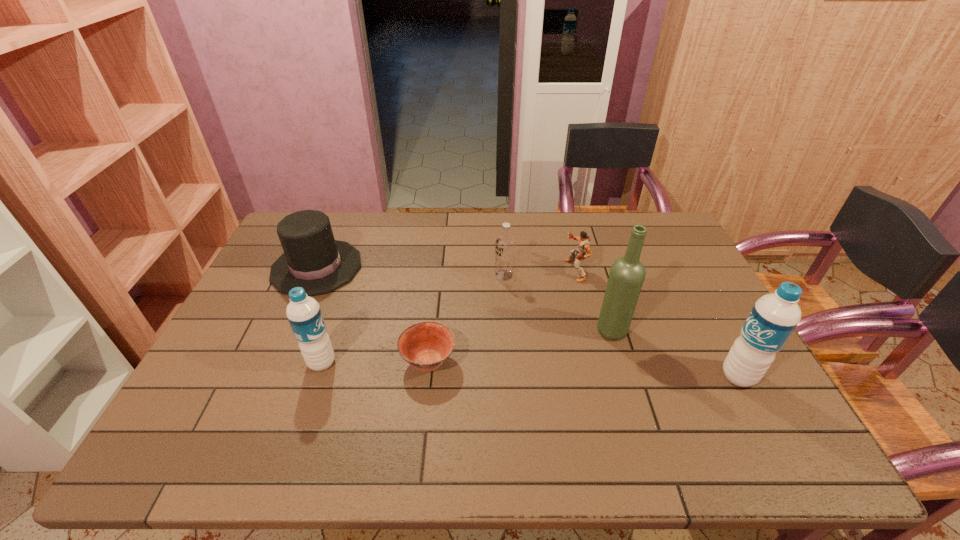
The height and width of the screenshot is (540, 960). Find the location of `free space at the near edge`. free space at the near edge is located at coordinates (440, 393).

Image resolution: width=960 pixels, height=540 pixels. Identify the location of vacant region at the left edge. (268, 368).

In the image, there is a desktop. Find the location of `vacant space at the right edge`. vacant space at the right edge is located at coordinates (662, 293).

At what (x,y) coordinates should I click in order to perform the action: click on vacant space at the far left corner of the desktop. Please return your answer as a coordinate pair (x, y). Looking at the image, I should click on (279, 248).

Identify the location of free space at the near right corner of the desktop. The image size is (960, 540). (768, 398).

The image size is (960, 540). In order to click on free space between the shorter water bottle and the right water bottle in this screenshot , I will do `click(530, 369)`.

Locate an element on the screen. vacant area between the puncher and the vodka is located at coordinates (540, 273).

Identify the location of free spot between the bowl and the left water bottle. This screenshot has height=540, width=960. (375, 362).

Locate an element on the screen. The width and height of the screenshot is (960, 540). vacant space that's between the taller water bottle and the dress hat is located at coordinates (528, 322).

Find the location of a particular element. free space that is in between the dress hat and the taller water bottle is located at coordinates (528, 322).